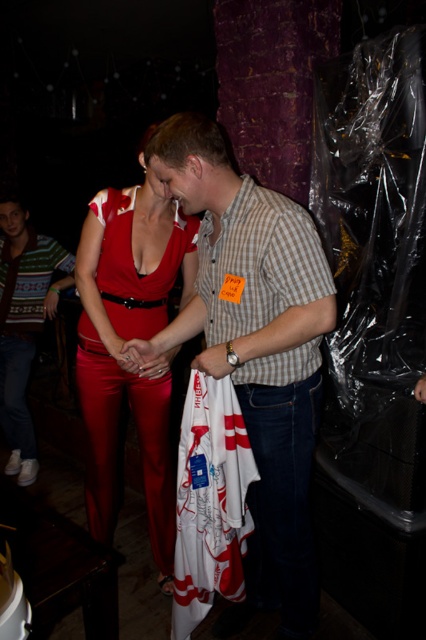
Consider the image. You are at a party and want to introduce yourself to the woman wearing the shiny red jumpsuit at center and the striped knit sweater at left. Which piece of clothing should you mention first if you want to start with the one closer to your left side?

You should mention the striped knit sweater at left first because it is positioned to the left of the shiny red jumpsuit at center.